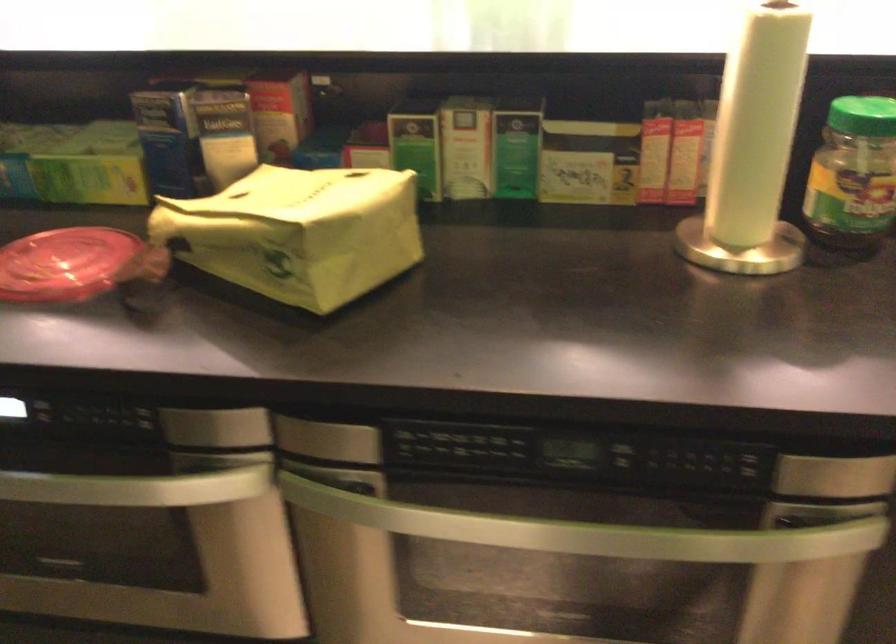
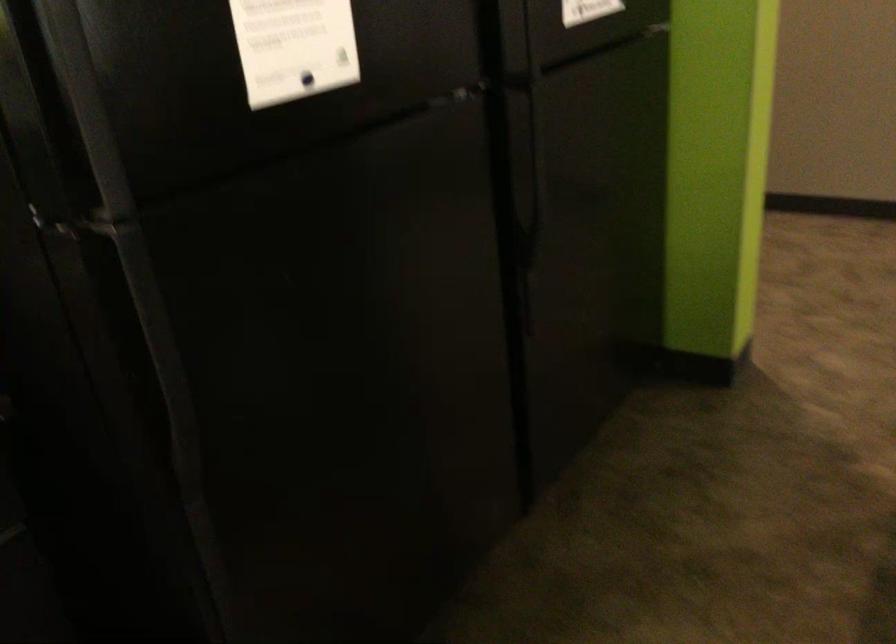
First-person continuous shooting, in which direction is the camera rotating?

The camera's rotation is toward left-down.